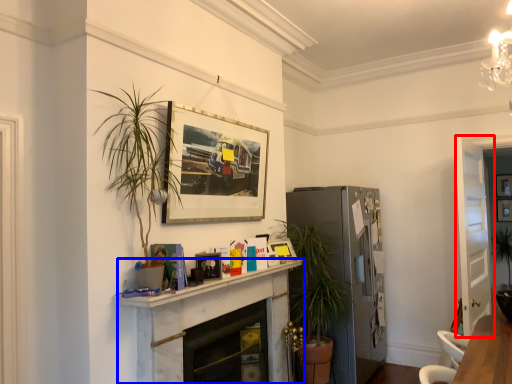
Question: Among these objects, which one is farthest to the camera, glass door (highlighted by a red box) or fireplace (highlighted by a blue box)?

Choices:
 (A) glass door
 (B) fireplace

Answer: (A)